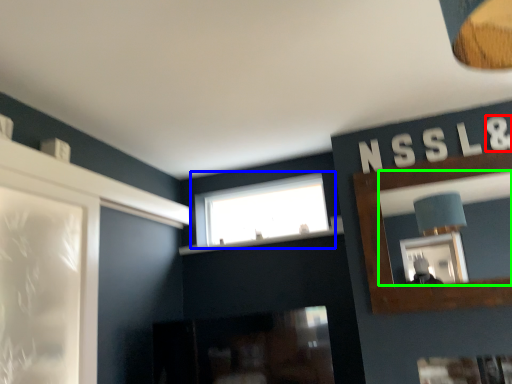
Question: Which object is positioned closest to letter (highlighted by a red box)? Select from window (highlighted by a blue box) and mirror (highlighted by a green box).

Choices:
 (A) window
 (B) mirror

Answer: (A)